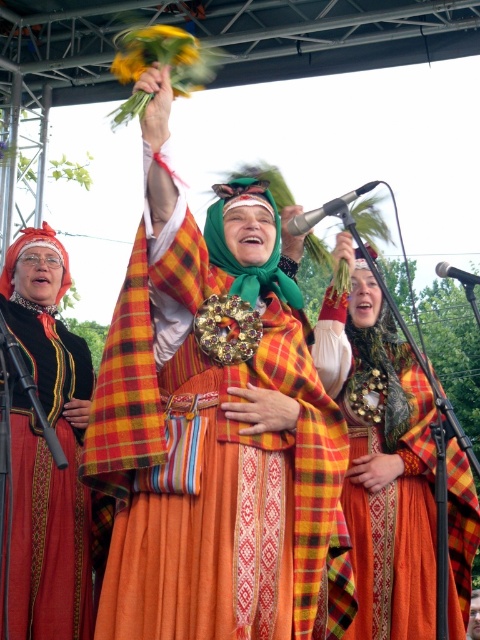
Between matte black dress at left and metallic shiny microphone at upper center, which one is positioned higher?

metallic shiny microphone at upper center is higher up.

Who is more forward, (13, 509) or (371, 180)?

Positioned in front is point (13, 509).

Which is behind, point (43, 225) or point (356, 234)?

Point (43, 225)

I want to click on matte black dress at left, so click(x=47, y=449).

Is point (45, 589) closer to camera compared to point (441, 262)?

Yes, it is.

Is matte black dress at left positioned before metallic silver microphone at upper center?

Yes.

The height and width of the screenshot is (640, 480). Find the location of `matte black dress at left`. matte black dress at left is located at coordinates (47, 449).

The height and width of the screenshot is (640, 480). Find the location of `matte black dress at left`. matte black dress at left is located at coordinates (47, 449).

Does matte orange dress at center have a lesser width compared to metallic shiny microphone at upper center?

Correct, matte orange dress at center's width is less than metallic shiny microphone at upper center's.

Can you confirm if matte orange dress at center is positioned to the right of metallic shiny microphone at upper center?

Incorrect, matte orange dress at center is not on the right side of metallic shiny microphone at upper center.

Between point (327, 348) and point (328, 214), which one is positioned behind?

Point (327, 348)

Where is `matte orange dress at center`? The width and height of the screenshot is (480, 640). matte orange dress at center is located at coordinates (382, 458).